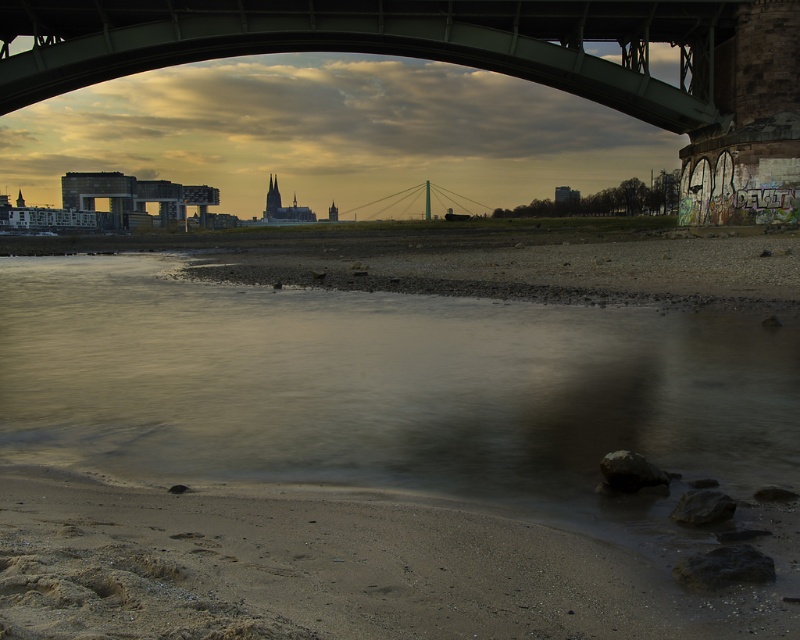
Question: Is brown sand at lower center positioned before green metallic bridge at upper center?

Choices:
 (A) yes
 (B) no

Answer: (A)

Question: Is brown sand at lower center to the right of green metallic bridge at upper center from the viewer's perspective?

Choices:
 (A) yes
 (B) no

Answer: (A)

Question: Where is brown sand at lower center located in relation to green metallic bridge at upper center in the image?

Choices:
 (A) left
 (B) right

Answer: (B)

Question: Which point is closer to the camera?

Choices:
 (A) green metallic bridge at upper center
 (B) brown sand at lower center

Answer: (B)